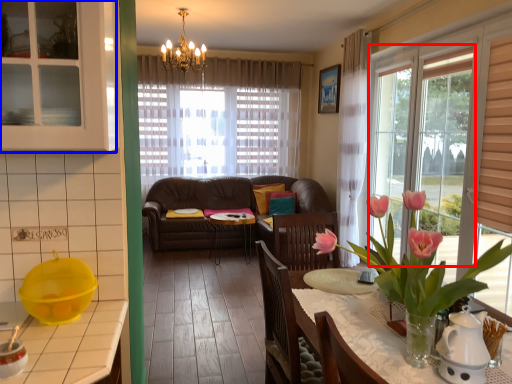
Question: Which point is closer to the camera, window (highlighted by a red box) or cabinetry (highlighted by a blue box)?

Choices:
 (A) window
 (B) cabinetry

Answer: (B)